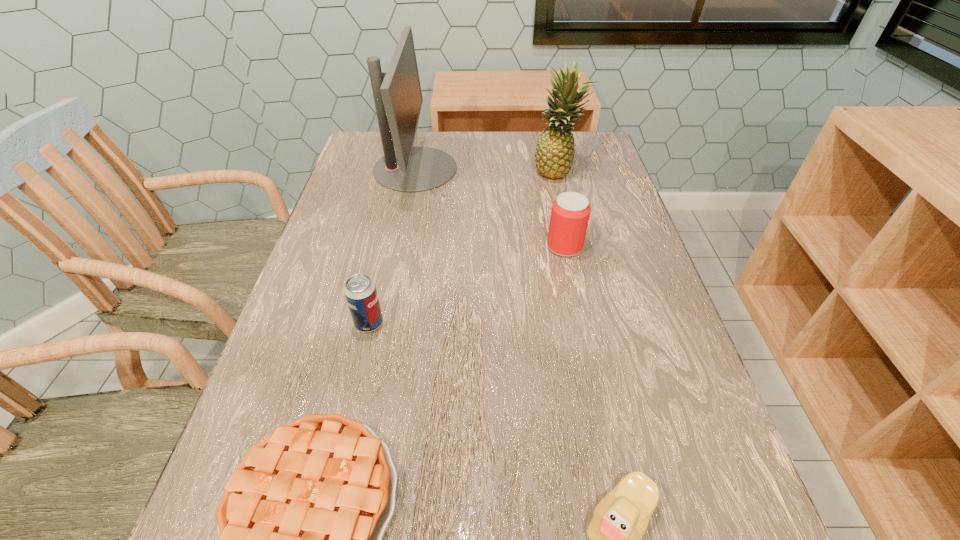
I want to click on computer monitor located in the far edge section of the desktop, so click(x=398, y=99).

You are a GUI agent. You are given a task and a screenshot of the screen. Output one action in this format:
    pyautogui.click(x=<x>, y=<y>)
    Task: Click on the pineapple that is at the far edge
    The width and height of the screenshot is (960, 540).
    Given the screenshot: What is the action you would take?
    pyautogui.click(x=554, y=154)

Locate an element on the screen. computer monitor at the left edge is located at coordinates (398, 99).

You are a GUI agent. You are given a task and a screenshot of the screen. Output one action in this format:
    pyautogui.click(x=<x>, y=<y>)
    Task: Click on the beer can present at the left edge
    
    Given the screenshot: What is the action you would take?
    pyautogui.click(x=360, y=291)

Where is `pineapple at the right edge`? pineapple at the right edge is located at coordinates (554, 154).

You are a GUI agent. You are given a task and a screenshot of the screen. Output one action in this format:
    pyautogui.click(x=<x>, y=<y>)
    Task: Click on the beer can situated at the right edge
    
    Given the screenshot: What is the action you would take?
    pyautogui.click(x=570, y=213)

This screenshot has height=540, width=960. I want to click on object present at the far left corner, so click(x=398, y=99).

What are the coordinates of `object that is positioned at the far right corner` in the screenshot? It's located at (554, 154).

Locate an element on the screen. The width and height of the screenshot is (960, 540). blank space at the far edge of the desktop is located at coordinates (489, 152).

Image resolution: width=960 pixels, height=540 pixels. I want to click on vacant area at the left edge, so click(x=343, y=401).